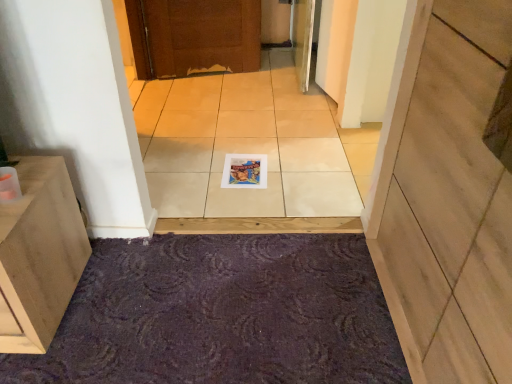
Question: Can you confirm if purple textured bath mat at lower center is shorter than white glossy tile at center?

Choices:
 (A) no
 (B) yes

Answer: (A)

Question: Is purple textured bath mat at lower center bigger than white glossy tile at center?

Choices:
 (A) yes
 (B) no

Answer: (B)

Question: Can you confirm if purple textured bath mat at lower center is thinner than white glossy tile at center?

Choices:
 (A) no
 (B) yes

Answer: (B)

Question: Considering the relative positions of purple textured bath mat at lower center and white glossy tile at center in the image provided, is purple textured bath mat at lower center to the left of white glossy tile at center from the viewer's perspective?

Choices:
 (A) yes
 (B) no

Answer: (A)

Question: Considering the relative positions of purple textured bath mat at lower center and white glossy tile at center in the image provided, is purple textured bath mat at lower center to the right of white glossy tile at center from the viewer's perspective?

Choices:
 (A) no
 (B) yes

Answer: (A)

Question: From the image's perspective, is purple textured bath mat at lower center over white glossy tile at center?

Choices:
 (A) no
 (B) yes

Answer: (A)

Question: Is matte paper magazine at center oriented away from white glossy tile at center?

Choices:
 (A) no
 (B) yes

Answer: (B)

Question: Is white glossy tile at center located within matte paper magazine at center?

Choices:
 (A) yes
 (B) no

Answer: (B)

Question: Does matte paper magazine at center have a larger size compared to white glossy tile at center?

Choices:
 (A) no
 (B) yes

Answer: (A)

Question: From the image's perspective, is matte paper magazine at center on white glossy tile at center?

Choices:
 (A) no
 (B) yes

Answer: (A)

Question: Is matte paper magazine at center positioned beyond the bounds of white glossy tile at center?

Choices:
 (A) yes
 (B) no

Answer: (B)

Question: Does matte paper magazine at center appear on the left side of white glossy tile at center?

Choices:
 (A) yes
 (B) no

Answer: (B)

Question: Is wooden at center next to white glossy tile at center and touching it?

Choices:
 (A) yes
 (B) no

Answer: (B)